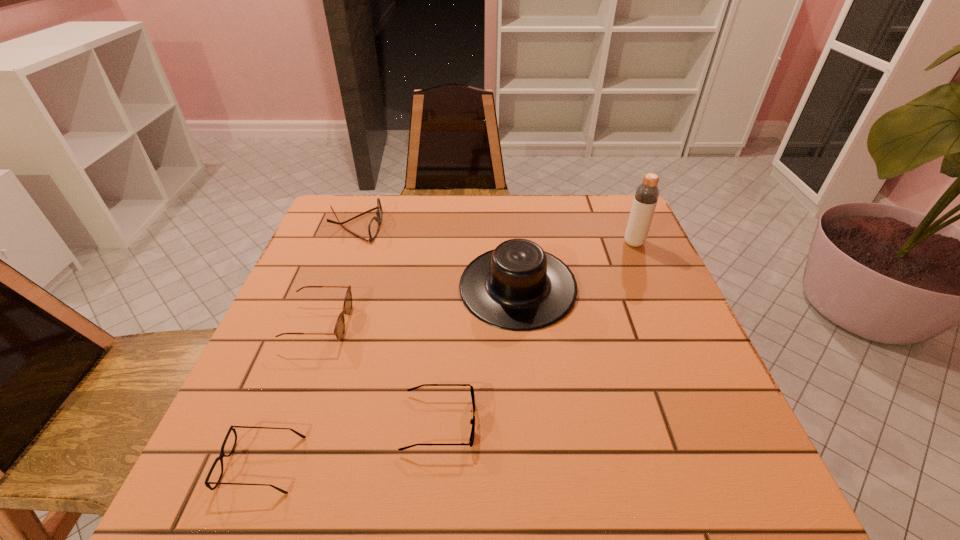
Where is `vacant region located on the front-facing side of the rightmost spectacles`? The height and width of the screenshot is (540, 960). vacant region located on the front-facing side of the rightmost spectacles is located at coordinates (514, 422).

You are a GUI agent. You are given a task and a screenshot of the screen. Output one action in this format:
    pyautogui.click(x=<x>, y=<y>)
    Task: Click on the bottle situated at the far edge
    The width and height of the screenshot is (960, 540).
    Given the screenshot: What is the action you would take?
    pyautogui.click(x=646, y=196)

Locate an element on the screen. The width and height of the screenshot is (960, 540). spectacles present at the far edge is located at coordinates click(374, 225).

Where is `object located in the near edge section of the desktop`? The height and width of the screenshot is (540, 960). object located in the near edge section of the desktop is located at coordinates (207, 482).

Locate an element on the screen. object located in the right edge section of the desktop is located at coordinates (646, 196).

Where is `object positioned at the far left corner`? This screenshot has width=960, height=540. object positioned at the far left corner is located at coordinates click(x=374, y=225).

Image resolution: width=960 pixels, height=540 pixels. I want to click on object that is at the near left corner, so click(207, 482).

Find the location of a particular element. The image size is (960, 540). object that is positioned at the far right corner is located at coordinates (646, 196).

You are a GUI agent. You are given a task and a screenshot of the screen. Output one action in this format:
    pyautogui.click(x=<x>, y=<y>)
    Task: Click on the vacant space at the far edge of the desktop
    The image size is (960, 540).
    Given the screenshot: What is the action you would take?
    pyautogui.click(x=469, y=228)

The image size is (960, 540). What are the coordinates of `vacant space at the near edge of the desktop` in the screenshot? It's located at (657, 505).